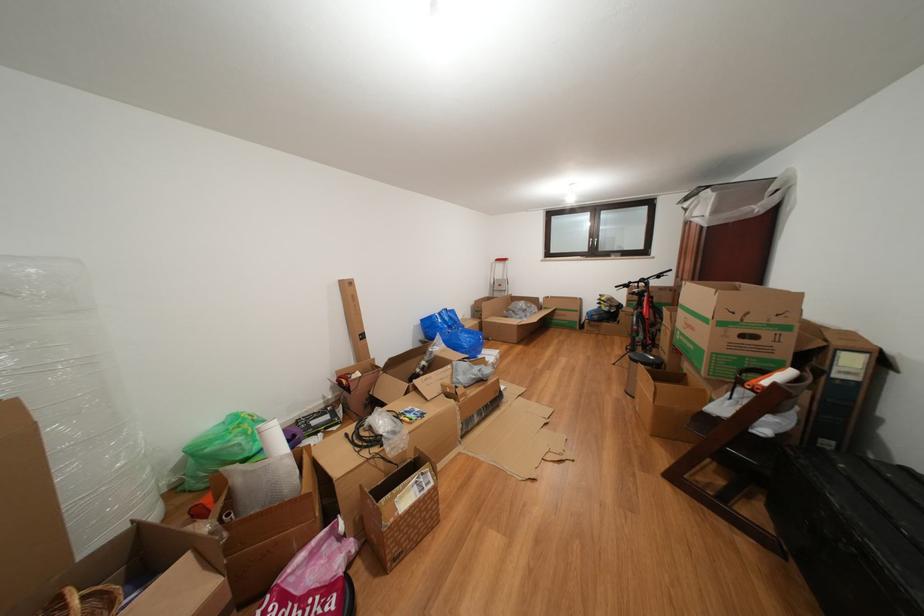
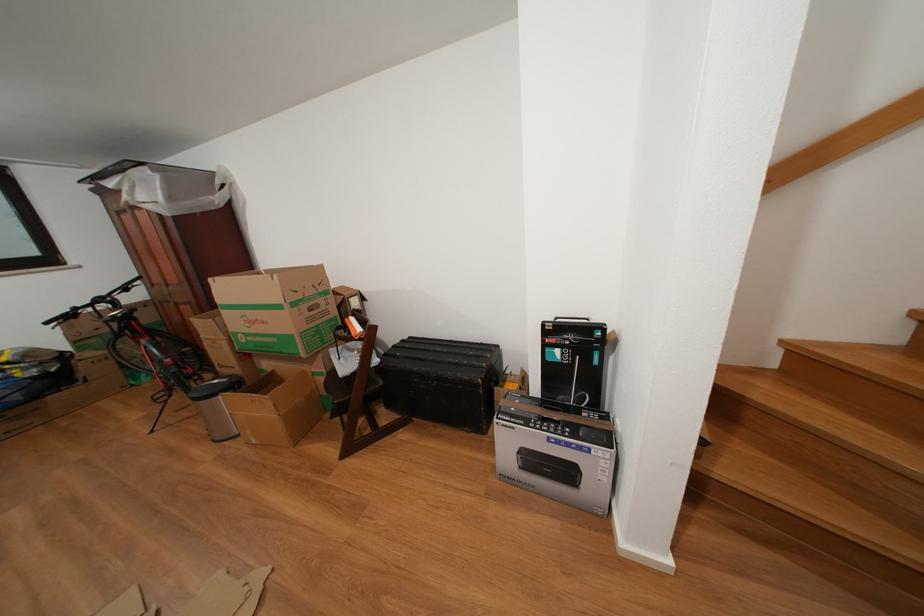
In the second image, find the point that corresponds to [700,334] in the first image.

(272, 328)